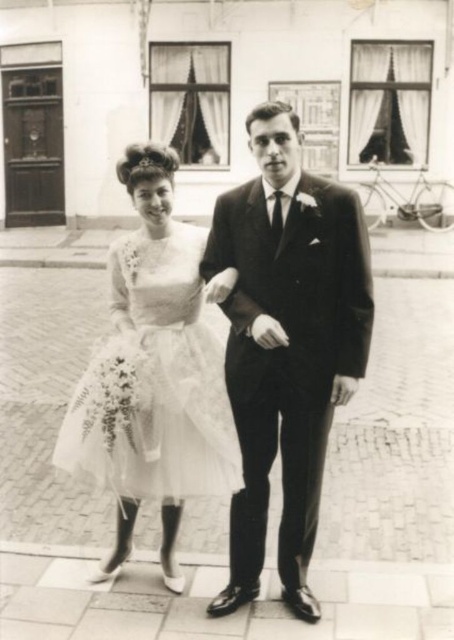
You are a photographer planning to take a group photo of the smooth black suit at center and the matte white tulle dress at center. You want to ensure both subjects are framed equally in the shot. Given their widths, which subject should you position closer to the camera to achieve this?

The smooth black suit at center has a lesser width compared to the matte white tulle dress at center. To frame them equally, position the smooth black suit at center closer to the camera so that its apparent size matches the wider matte white tulle dress at center.

You are standing at the center of the image and want to move towards the smooth black suit at center. In which direction should you move?

You should move towards the center of the image to reach the smooth black suit at center, as it is already positioned at point (286,344).